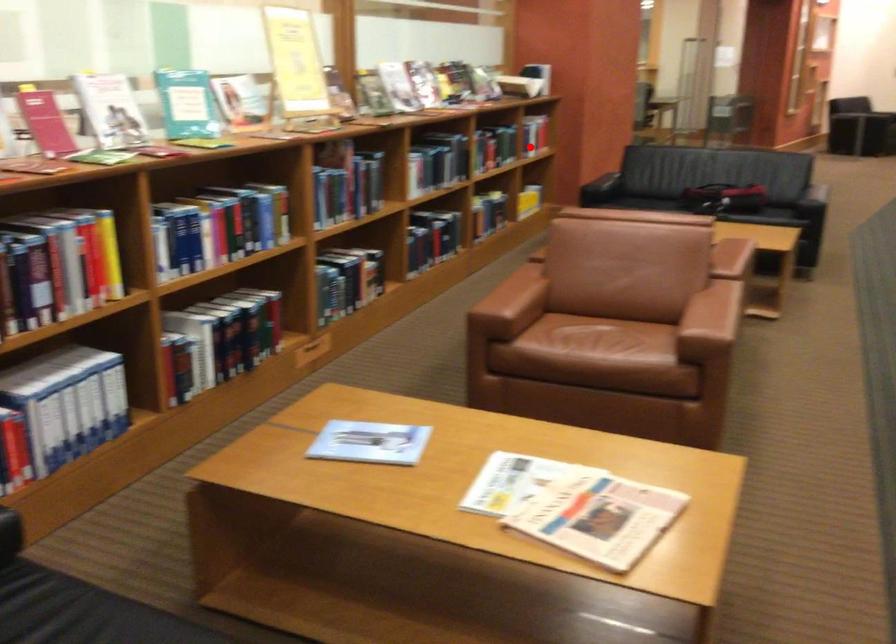
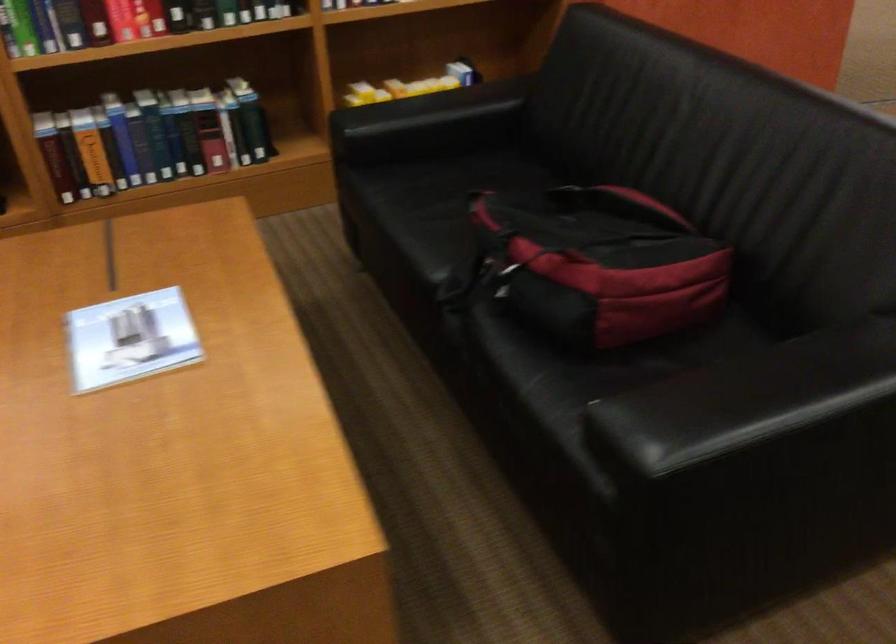
Question: I am providing you with two images of the same scene from different viewpoints. In image1, a red point is highlighted. Considering the same 3D point in image2, which of the following is correct?

Choices:
 (A) It is closer
 (B) It is farther

Answer: (A)